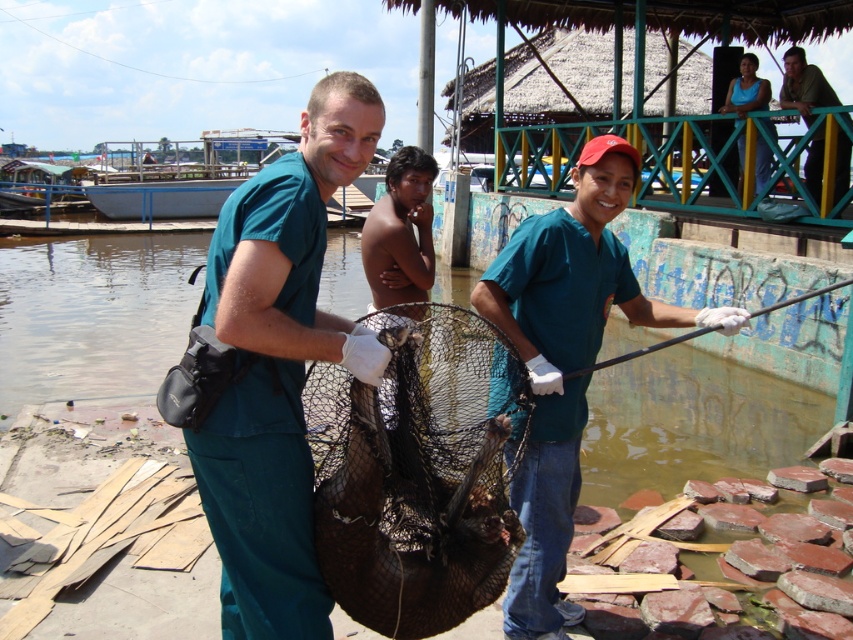
Looking at this image, based on the coordinates provided, which object is located at point (566, 360)?

The point (566, 360) marks the green matte shirt at center.

You are a photographer standing at the waterway and see the green matte shirt at center and the black metal fishing pole at right. Which object is taller?

The green matte shirt at center is taller than the black metal fishing pole at right.